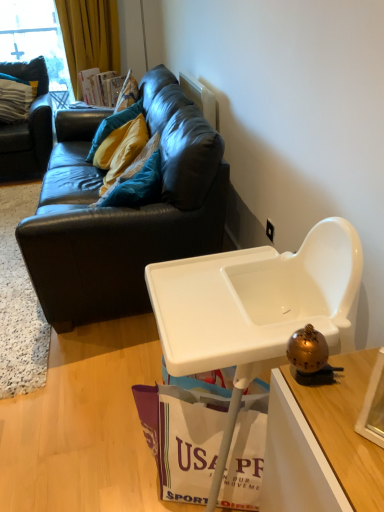
Question: Does white plastic power outlet at upper right come in front of teal fabric pillow at upper left, the first pillow positioned from the front?

Choices:
 (A) no
 (B) yes

Answer: (B)

Question: Is white plastic power outlet at upper right to the right of teal fabric pillow at upper left, the second pillow in the left-to-right sequence, from the viewer's perspective?

Choices:
 (A) no
 (B) yes

Answer: (B)

Question: Can we say white plastic power outlet at upper right lies outside teal fabric pillow at upper left, arranged as the second pillow when viewed from the top?

Choices:
 (A) no
 (B) yes

Answer: (B)

Question: From the image's perspective, is white plastic power outlet at upper right on top of teal fabric pillow at upper left, marked as the first pillow in a right-to-left arrangement?

Choices:
 (A) yes
 (B) no

Answer: (B)

Question: Is white plastic power outlet at upper right with teal fabric pillow at upper left, the second pillow in the left-to-right sequence?

Choices:
 (A) yes
 (B) no

Answer: (B)

Question: From the image's perspective, is white plastic power outlet at upper right located beneath teal fabric pillow at upper left, arranged as the second pillow when viewed from the top?

Choices:
 (A) yes
 (B) no

Answer: (A)

Question: From a real-world perspective, is dark brown leather couch at upper left, the first studio couch in the left-to-right sequence, under white plastic highchair at lower right?

Choices:
 (A) yes
 (B) no

Answer: (B)

Question: Is dark brown leather couch at upper left, the first studio couch in the left-to-right sequence, positioned behind white plastic highchair at lower right?

Choices:
 (A) yes
 (B) no

Answer: (A)

Question: Is dark brown leather couch at upper left, the first studio couch in the left-to-right sequence, to the right of white plastic highchair at lower right from the viewer's perspective?

Choices:
 (A) yes
 (B) no

Answer: (B)

Question: From the image's perspective, is dark brown leather couch at upper left, the first studio couch in the left-to-right sequence, above white plastic highchair at lower right?

Choices:
 (A) yes
 (B) no

Answer: (A)

Question: Can we say dark brown leather couch at upper left, the first studio couch in the left-to-right sequence, lies outside white plastic highchair at lower right?

Choices:
 (A) no
 (B) yes

Answer: (B)

Question: From a real-world perspective, is dark brown leather couch at upper left, the first studio couch in the left-to-right sequence, on top of white plastic highchair at lower right?

Choices:
 (A) yes
 (B) no

Answer: (A)

Question: Considering the relative sizes of white paper shopping bag at lower center and teal fabric pillow at upper left, arranged as the second pillow when viewed from the top, in the image provided, is white paper shopping bag at lower center smaller than teal fabric pillow at upper left, arranged as the second pillow when viewed from the top,?

Choices:
 (A) yes
 (B) no

Answer: (A)